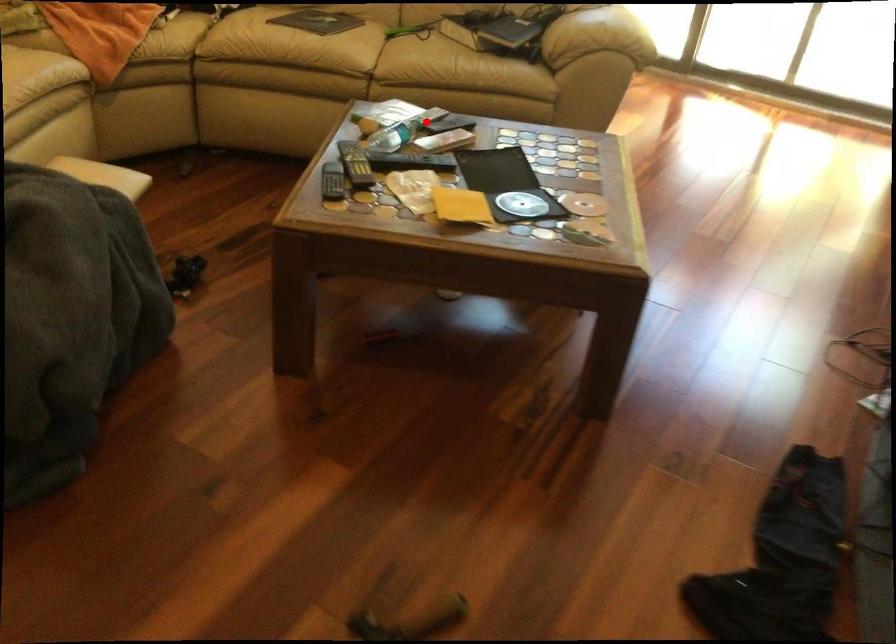
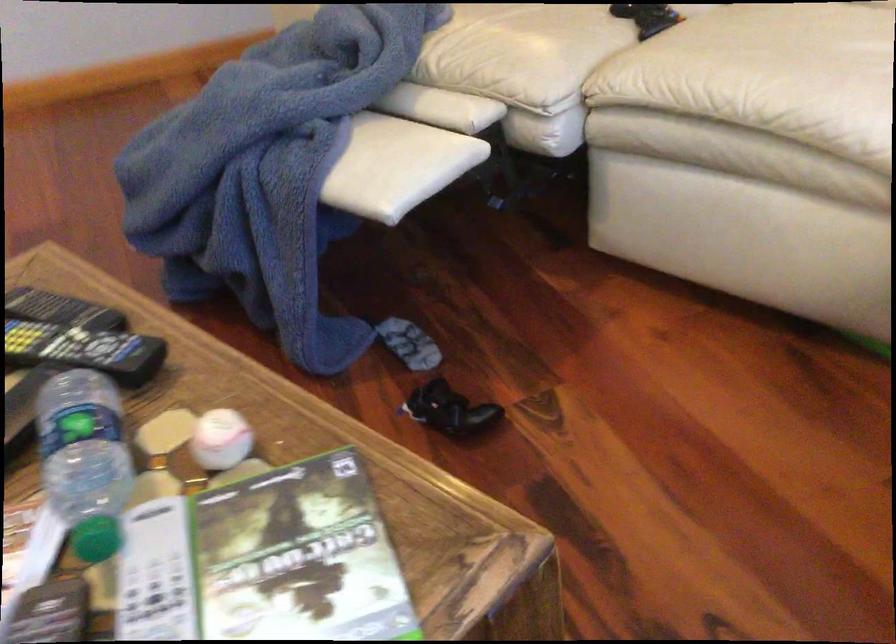
Find the pixel in the second image that matches the highlighted location in the first image.

(96, 538)